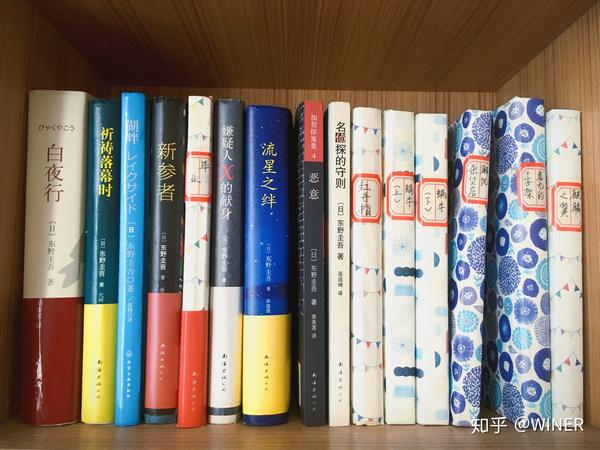
Locate an element on the screen. This screenshot has width=600, height=450. five left-most books is located at coordinates (54, 252), (100, 252), (126, 256), (162, 259), (195, 264).